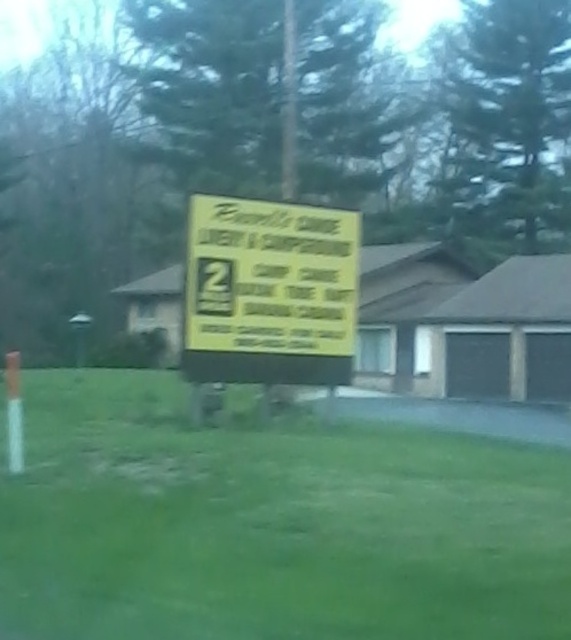
Which is more to the left, green grass at center or yellow paper sign at center?

green grass at center

Based on the photo, can you confirm if green grass at center is positioned to the right of yellow paper sign at center?

In fact, green grass at center is to the left of yellow paper sign at center.

Does point (87, 397) come farther from viewer compared to point (251, 324)?

Yes.

Identify the location of green grass at center. Image resolution: width=571 pixels, height=640 pixels. (271, 524).